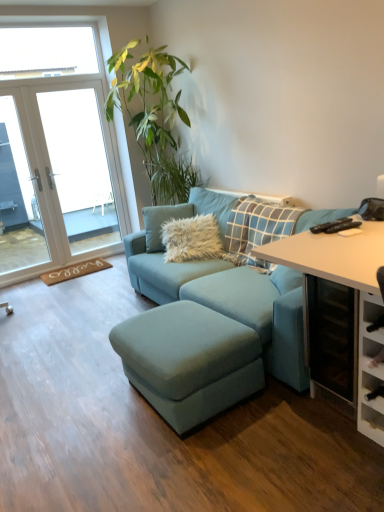
Question: From a real-world perspective, relative to suede blue studio couch at center, is white glass door at upper left vertically above or below?

Choices:
 (A) below
 (B) above

Answer: (B)

Question: Is point (28, 78) closer or farther from the camera than point (244, 244)?

Choices:
 (A) closer
 (B) farther

Answer: (B)

Question: Estimate the real-world distances between objects in this image. Which object is farther from the white glass door at upper left?

Choices:
 (A) white glass door at left
 (B) suede blue studio couch at center
 (C) suede blue footrest at center
 (D) white glossy table at right
 (E) fuzzy white pillow at center

Answer: (D)

Question: Estimate the real-world distances between objects in this image. Which object is closer to the white glass door at left?

Choices:
 (A) white glass door at upper left
 (B) white glossy table at right
 (C) suede blue studio couch at center
 (D) fuzzy white pillow at center
 (E) suede blue footrest at center

Answer: (A)